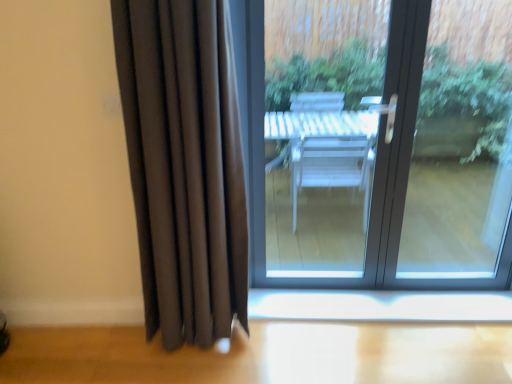
Question: Could you tell me if matte glass door at center is turned towards matte black curtain at left?

Choices:
 (A) no
 (B) yes

Answer: (B)

Question: Is matte glass door at center not near matte black curtain at left?

Choices:
 (A) yes
 (B) no

Answer: (A)

Question: From the image's perspective, is matte glass door at center on top of matte black curtain at left?

Choices:
 (A) no
 (B) yes

Answer: (B)

Question: From a real-world perspective, is matte glass door at center located higher than matte black curtain at left?

Choices:
 (A) yes
 (B) no

Answer: (B)

Question: Is the surface of matte glass door at center in direct contact with matte black curtain at left?

Choices:
 (A) yes
 (B) no

Answer: (B)

Question: Would you say matte glass door at center is to the left or to the right of white glossy window sill at lower center in the picture?

Choices:
 (A) right
 (B) left

Answer: (B)

Question: Looking at their shapes, would you say matte glass door at center is wider or thinner than white glossy window sill at lower center?

Choices:
 (A) wide
 (B) thin

Answer: (A)

Question: Is matte glass door at center taller or shorter than white glossy window sill at lower center?

Choices:
 (A) tall
 (B) short

Answer: (A)

Question: Considering their positions, is matte glass door at center located in front of or behind white glossy window sill at lower center?

Choices:
 (A) behind
 (B) front

Answer: (B)

Question: Does point (231, 124) appear closer or farther from the camera than point (305, 291)?

Choices:
 (A) closer
 (B) farther

Answer: (A)

Question: Choose the correct answer: Is matte black curtain at left inside white glossy window sill at lower center or outside it?

Choices:
 (A) outside
 (B) inside

Answer: (A)

Question: From their relative heights in the image, would you say matte black curtain at left is taller or shorter than white glossy window sill at lower center?

Choices:
 (A) short
 (B) tall

Answer: (B)

Question: Relative to white glossy window sill at lower center, is matte black curtain at left in front or behind?

Choices:
 (A) behind
 (B) front

Answer: (B)

Question: Relative to matte glass door at center, is white glossy window sill at lower center in front or behind?

Choices:
 (A) behind
 (B) front

Answer: (A)

Question: Considering the relative positions of white glossy window sill at lower center and matte glass door at center in the image provided, is white glossy window sill at lower center to the left or to the right of matte glass door at center?

Choices:
 (A) left
 (B) right

Answer: (B)